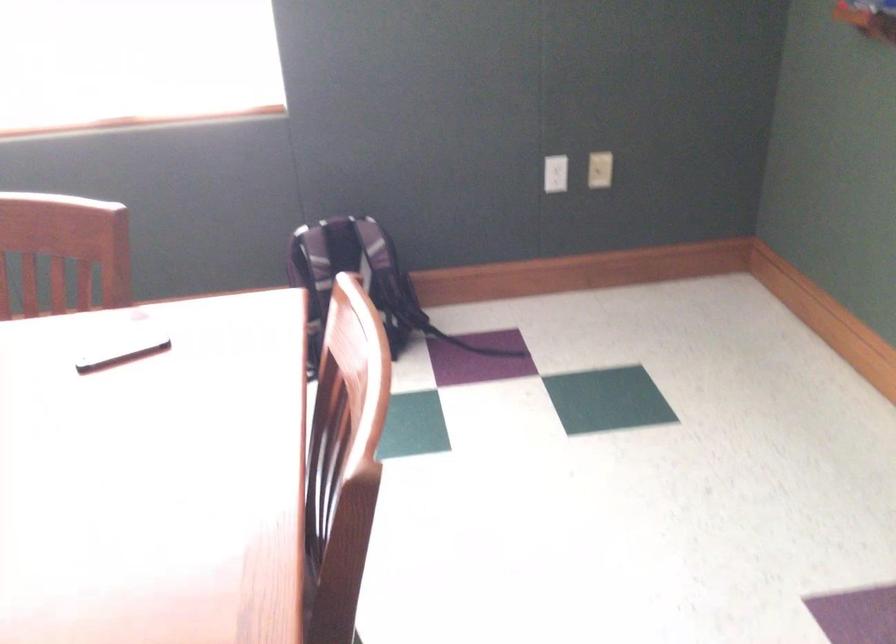
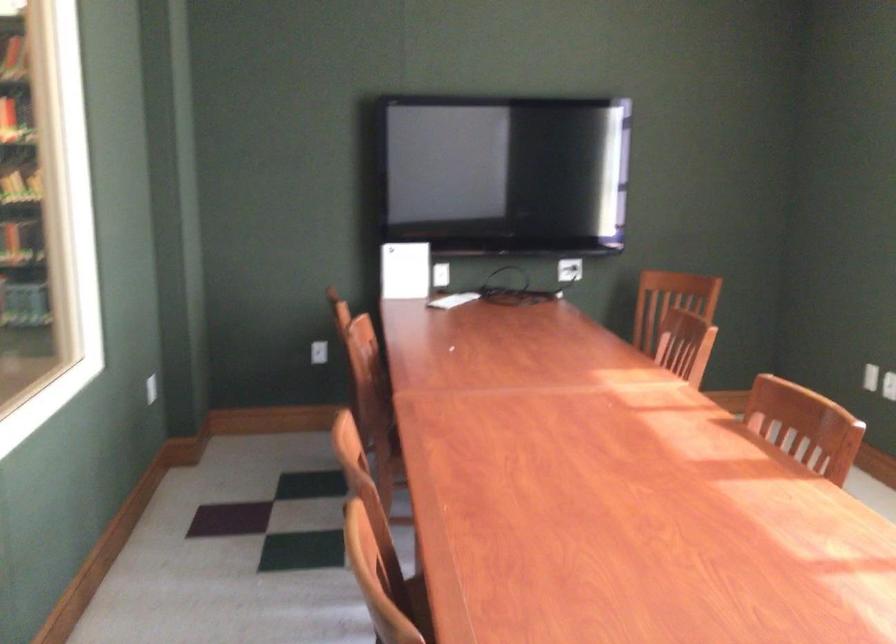
Question: The camera is either moving clockwise (left) or counter-clockwise (right) around the object. The first image is from the beginning of the video and the second image is from the end. Is the camera moving left or right when shooting the video?

Choices:
 (A) Left
 (B) Right

Answer: (B)